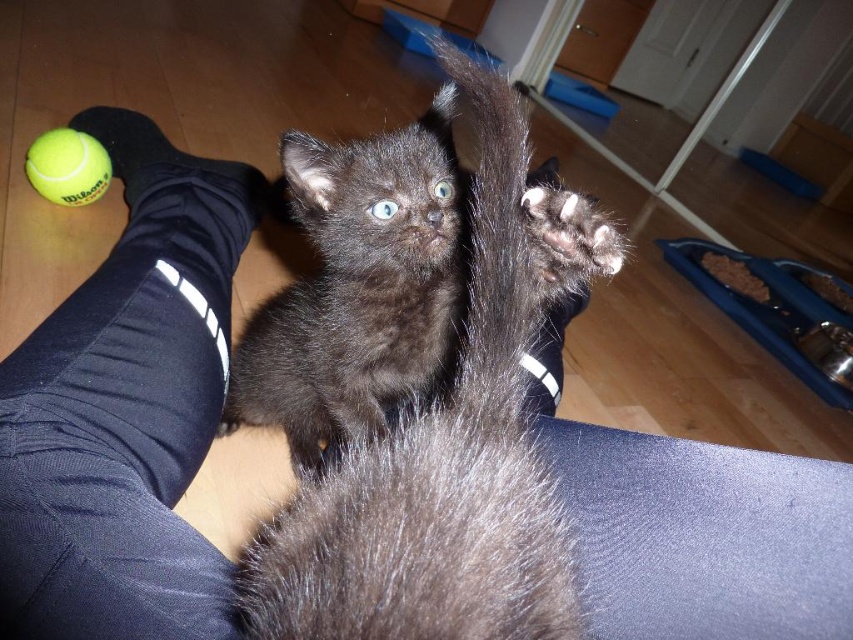
Where is the black fur cat at center located in the image?

The black fur cat at center is located at point (437, 472).

You are a robotic pet feeder that needs to place a new treat bowl between the black fur cat at center and the green rubber tennis ball at lower left. Can you position it exactly halfway between them?

The black fur cat at center and green rubber tennis ball at lower left are 1.23 meters apart, so placing the treat bowl exactly halfway would require positioning it 0.615 meters from each object.

You are taking a photo of the scene and want to focus on both the black kitten and the larger animal. The coordinates of their eyes are given as point [555,604] and point [68,156]. Which eye should you focus on first to ensure both are in focus?

You should focus on point [555,604] first because it is closer to the camera than point [68,156], ensuring both eyes are in focus when adjusting the focus from near to far.